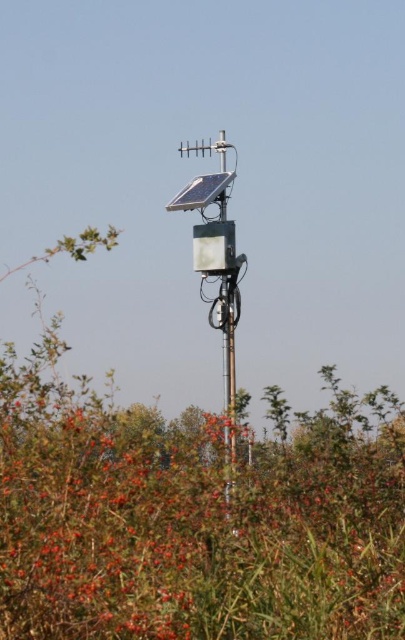
Question: Is green leafy bush at center to the right of metallic solar panel at center from the viewer's perspective?

Choices:
 (A) yes
 (B) no

Answer: (B)

Question: Among these objects, which one is farthest from the camera?

Choices:
 (A) metallic pole at center
 (B) green leafy bush at center
 (C) metallic solar panel at center

Answer: (C)

Question: Considering the real-world distances, which object is closest to the green leafy bush at center?

Choices:
 (A) metallic pole at center
 (B) metallic solar panel at center

Answer: (B)

Question: Which object appears closest to the camera in this image?

Choices:
 (A) green leafy bush at center
 (B) metallic solar panel at center

Answer: (A)

Question: Is metallic solar panel at center to the left of metallic pole at center from the viewer's perspective?

Choices:
 (A) no
 (B) yes

Answer: (B)

Question: In this image, where is green leafy bush at center located relative to metallic pole at center?

Choices:
 (A) below
 (B) above

Answer: (A)